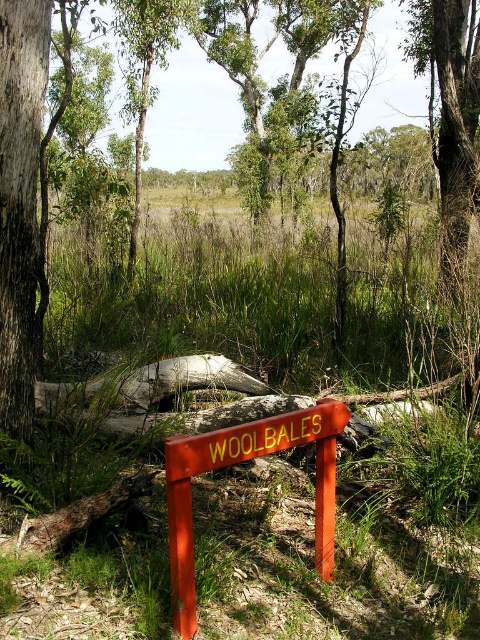
Question: Among these points, which one is farthest from the camera?

Choices:
 (A) (408, 604)
 (B) (308, 426)

Answer: (A)

Question: Can you confirm if green grass at center is thinner than orange painted wooden sign at center?

Choices:
 (A) no
 (B) yes

Answer: (A)

Question: Which point is farther to the camera?

Choices:
 (A) (317, 440)
 (B) (191, 346)

Answer: (B)

Question: Is green grass at center to the left of orange painted wooden sign at center from the viewer's perspective?

Choices:
 (A) yes
 (B) no

Answer: (B)

Question: Which object is closer to the camera taking this photo?

Choices:
 (A) orange painted wooden sign at center
 (B) green grass at center

Answer: (A)

Question: Is green grass at center bigger than orange painted wooden sign at center?

Choices:
 (A) yes
 (B) no

Answer: (A)